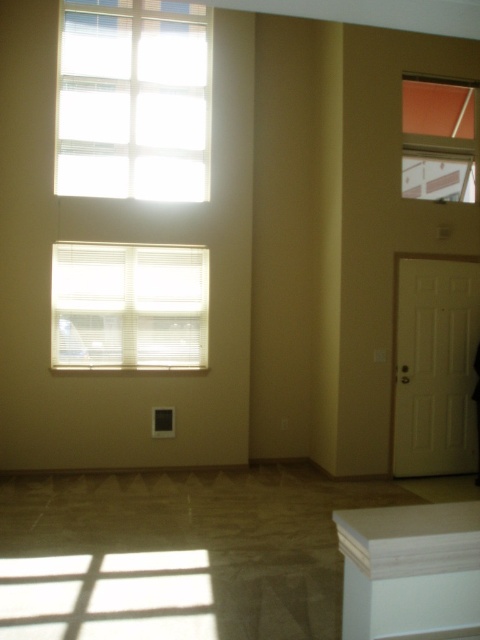
Is white textured blinds at upper left to the left of white wood cabinet at lower right from the viewer's perspective?

Indeed, white textured blinds at upper left is positioned on the left side of white wood cabinet at lower right.

Can you confirm if white textured blinds at upper left is bigger than white wood cabinet at lower right?

Correct, white textured blinds at upper left is larger in size than white wood cabinet at lower right.

Who is more forward, (108,144) or (344,556)?

Point (344,556) is more forward.

Where is `white textured blinds at upper left`? white textured blinds at upper left is located at coordinates (133, 99).

Who is positioned more to the left, white textured blinds at upper left or white matte blinds at upper left?

white matte blinds at upper left is more to the left.

Can you confirm if white textured blinds at upper left is thinner than white matte blinds at upper left?

No, white textured blinds at upper left is not thinner than white matte blinds at upper left.

Where is `white textured blinds at upper left`? The image size is (480, 640). white textured blinds at upper left is located at coordinates (133, 99).

Where is `white textured blinds at upper left`? white textured blinds at upper left is located at coordinates (133, 99).

How much distance is there between white textured blinds at upper left and matte glass window at upper right?

9.05 feet

Who is more distant from viewer, (x=141, y=81) or (x=433, y=109)?

The point (x=141, y=81) is behind.

Between point (117, 113) and point (441, 112), which one is positioned behind?

Point (441, 112)

The width and height of the screenshot is (480, 640). I want to click on white textured blinds at upper left, so click(133, 99).